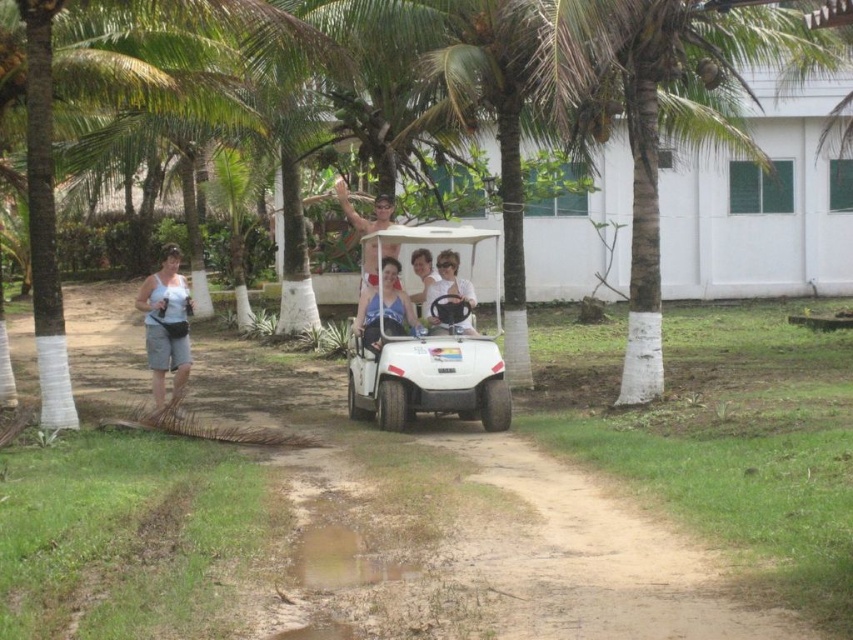
You are a photographer trying to capture a candid shot of the two individuals wearing the white fabric tank top at left and the matte white shirt at center. Since both are wearing white, you want to adjust your camera settings to ensure their clothing stands out. Which clothing item should you focus on if you want to highlight the one with a taller silhouette?

The white fabric tank top at left has a greater height compared to the matte white shirt at center, so focusing on it would better highlight the taller silhouette.

You are standing on the dirt path and see two people wearing white tops, the white fabric tank top at left and the matte white shirt at center. Which one is positioned more to the left side?

The white fabric tank top at left is positioned more to the left side than the matte white shirt at center.

You are a photographer standing on the dirt path and want to capture a photo of the white fabric tank top at left and the matte white steering wheel at center. Which object should you focus on first if you want to ensure both are in sharp focus?

The white fabric tank top at left is above the matte white steering wheel at center, so focusing on the white fabric tank top at left first would ensure both are in sharp focus as the tank top is closer to the camera.